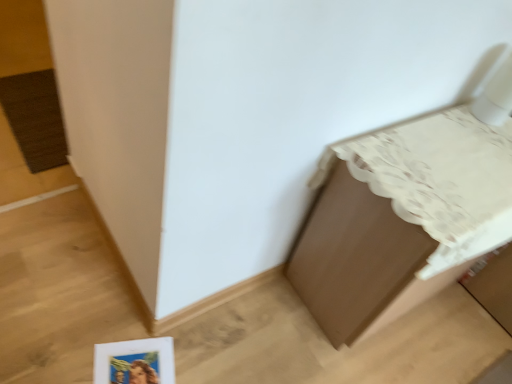
The width and height of the screenshot is (512, 384). I want to click on blank space above brown matte cabinet at upper right (from a real-world perspective), so coord(461,158).